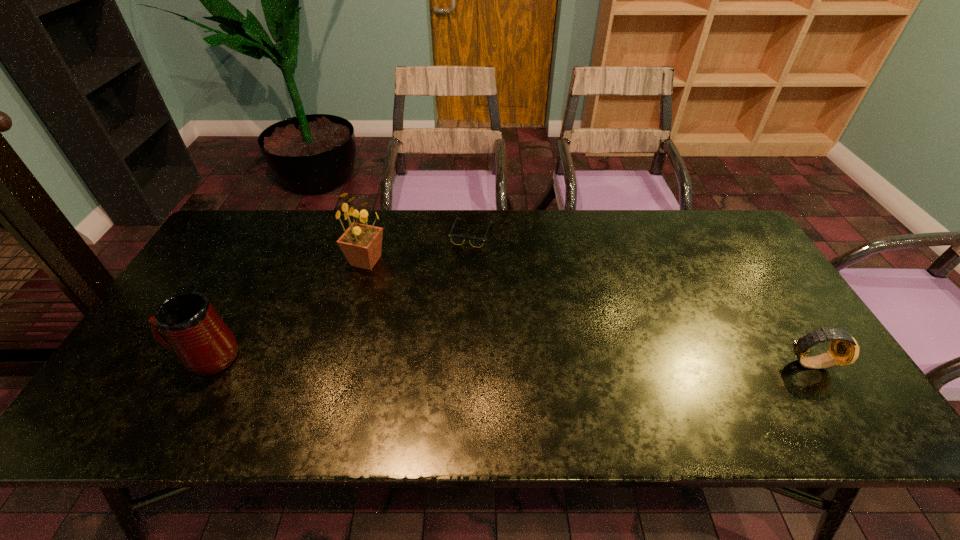
Where is `object present at the near left corner`? object present at the near left corner is located at coordinates (186, 323).

Where is `object that is positioned at the near right corner`? object that is positioned at the near right corner is located at coordinates (844, 350).

The height and width of the screenshot is (540, 960). I want to click on vacant region at the far edge of the desktop, so click(501, 232).

This screenshot has height=540, width=960. In the image, there is a desktop. Identify the location of free region at the near edge. (389, 378).

At what (x,y) coordinates should I click in order to perform the action: click on vacant region at the left edge of the desktop. Please return your answer as a coordinate pair (x, y). The height and width of the screenshot is (540, 960). Looking at the image, I should click on (203, 294).

You are a GUI agent. You are given a task and a screenshot of the screen. Output one action in this format:
    pyautogui.click(x=<x>, y=<y>)
    Task: Click on the vacant space at the right edge of the desktop
    
    Given the screenshot: What is the action you would take?
    pyautogui.click(x=754, y=275)

The image size is (960, 540). I want to click on free space at the far right corner, so click(x=722, y=228).

The height and width of the screenshot is (540, 960). What are the coordinates of `vacant space in between the second shortest object and the shortest object` in the screenshot? It's located at (640, 298).

The height and width of the screenshot is (540, 960). What are the coordinates of `empty location between the third object from right to left and the shortest object` in the screenshot? It's located at (419, 247).

Identify the location of free area in between the sunglasses and the tallest object. This screenshot has height=540, width=960. (419, 247).